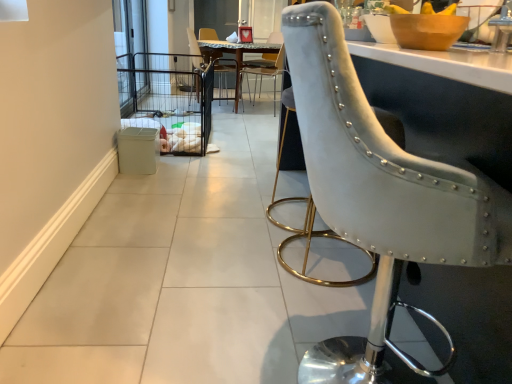
You are a GUI agent. You are given a task and a screenshot of the screen. Output one action in this format:
    pyautogui.click(x=<x>, y=<y>)
    Task: Click on the vacant area that is situated to the right of white plastic trash bin at lower left
    The height and width of the screenshot is (384, 512).
    Given the screenshot: What is the action you would take?
    pyautogui.click(x=175, y=162)